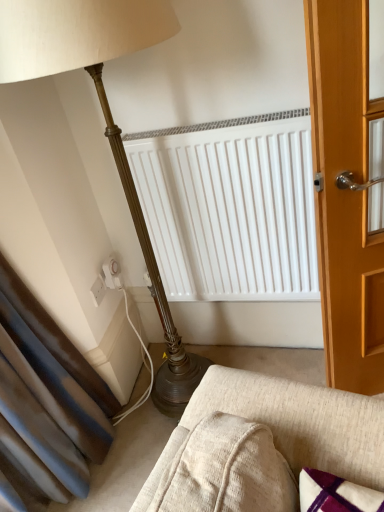
Question: In terms of height, does textured beige fabric couch at lower center look taller or shorter compared to white plastic electric outlet at lower left, marked as the first electric outlet in a left-to-right arrangement?

Choices:
 (A) short
 (B) tall

Answer: (A)

Question: Looking at their shapes, would you say textured beige fabric couch at lower center is wider or thinner than white plastic electric outlet at lower left, the 2th electric outlet when ordered from right to left?

Choices:
 (A) thin
 (B) wide

Answer: (B)

Question: Which object is the farthest from the textured beige fabric couch at lower center?

Choices:
 (A) white plastic electric outlet at lower left, the 2th electric outlet when ordered from right to left
 (B) white plastic electric outlet at lower left, the 2th electric outlet from the left

Answer: (B)

Question: Which object is positioned closest to the textured beige fabric couch at lower center?

Choices:
 (A) white plastic electric outlet at lower left, the 2th electric outlet from the left
 (B) white plastic electric outlet at lower left, marked as the first electric outlet in a left-to-right arrangement

Answer: (B)